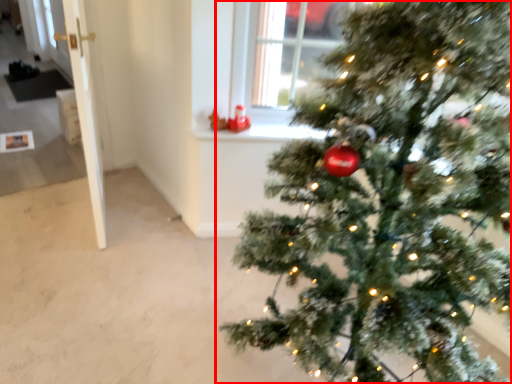
Question: From the image's perspective, where is christmas tree (annotated by the red box) located in relation to window sill in the image?

Choices:
 (A) above
 (B) below

Answer: (B)